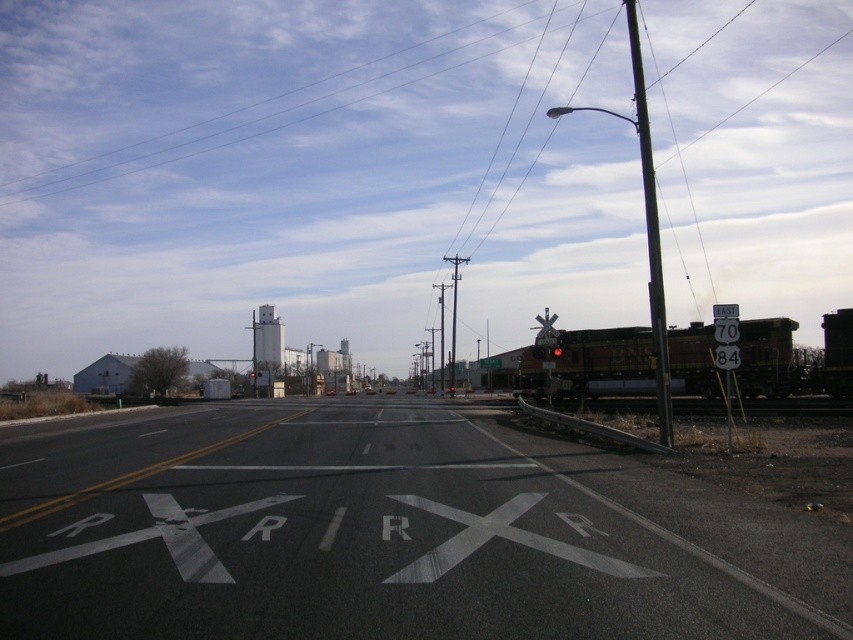
You are standing at the railroad crossing on the rural road and see two points marked on the road ahead. Which point is closer to you, point [659,449] or point [561,349]?

Point [659,449] is closer to the viewer than point [561,349].

You are a driver approaching the railroad crossing and see the brown textured train at right and the red glass traffic light at center. Which object is bigger in the image?

The brown textured train at right is larger in size than the red glass traffic light at center.

You are driving a car and see the brown textured train at right and the red glass traffic light at center. Which object is closer to the ground?

The brown textured train at right is located below the red glass traffic light at center, so it is closer to the ground.